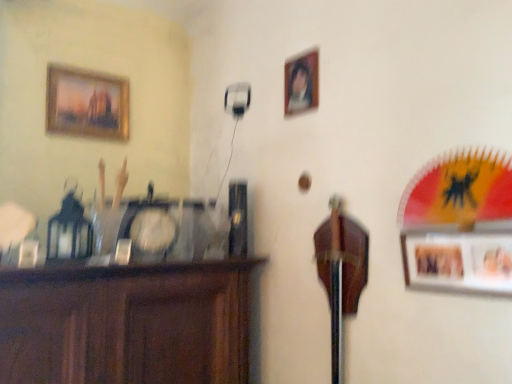
Question: Is gold-framed painting at upper left, which appears as the third picture frame when viewed from the right, not within wooden photo frame at right, which is counted as the third picture frame, starting from the top?

Choices:
 (A) no
 (B) yes

Answer: (B)

Question: Does gold-framed painting at upper left, which is the first picture frame in left-to-right order, appear on the left side of wooden photo frame at right, the 1th picture frame in the right-to-left sequence?

Choices:
 (A) yes
 (B) no

Answer: (A)

Question: Is gold-framed painting at upper left, which appears as the second picture frame when viewed from the top, further to the viewer compared to wooden photo frame at right, which is counted as the 1th picture frame, starting from the front?

Choices:
 (A) yes
 (B) no

Answer: (A)

Question: From the image's perspective, does gold-framed painting at upper left, which appears as the second picture frame when viewed from the top, appear lower than wooden photo frame at right, which is the 3th picture frame from back to front?

Choices:
 (A) no
 (B) yes

Answer: (A)

Question: Considering the relative sizes of gold-framed painting at upper left, which appears as the second picture frame when viewed from the top, and wooden photo frame at right, which is the 3th picture frame from back to front, in the image provided, is gold-framed painting at upper left, which appears as the second picture frame when viewed from the top, wider than wooden photo frame at right, which is the 3th picture frame from back to front,?

Choices:
 (A) no
 (B) yes

Answer: (B)

Question: Considering the relative sizes of gold-framed painting at upper left, the third picture frame from the front, and wooden photo frame at right, which is counted as the 1th picture frame, starting from the front, in the image provided, is gold-framed painting at upper left, the third picture frame from the front, taller than wooden photo frame at right, which is counted as the 1th picture frame, starting from the front,?

Choices:
 (A) no
 (B) yes

Answer: (B)

Question: Is wooden photo frame at right, the 1th picture frame in the right-to-left sequence, to the right of brown wood cabinet at left from the viewer's perspective?

Choices:
 (A) yes
 (B) no

Answer: (A)

Question: Does wooden photo frame at right, which is the 3th picture frame from back to front, turn towards brown wood cabinet at left?

Choices:
 (A) no
 (B) yes

Answer: (A)

Question: Is wooden photo frame at right, which is counted as the third picture frame, starting from the top, positioned with its back to brown wood cabinet at left?

Choices:
 (A) yes
 (B) no

Answer: (B)

Question: From the image's perspective, is wooden photo frame at right, acting as the third picture frame starting from the left, on brown wood cabinet at left?

Choices:
 (A) yes
 (B) no

Answer: (A)

Question: Can you confirm if wooden photo frame at right, which is counted as the third picture frame, starting from the top, is smaller than brown wood cabinet at left?

Choices:
 (A) yes
 (B) no

Answer: (A)

Question: Does wooden photo frame at right, which is the 3th picture frame from back to front, have a larger size compared to brown wood cabinet at left?

Choices:
 (A) yes
 (B) no

Answer: (B)

Question: Does brown wood cabinet at left come in front of gold-framed painting at upper left, which is the first picture frame in left-to-right order?

Choices:
 (A) yes
 (B) no

Answer: (A)